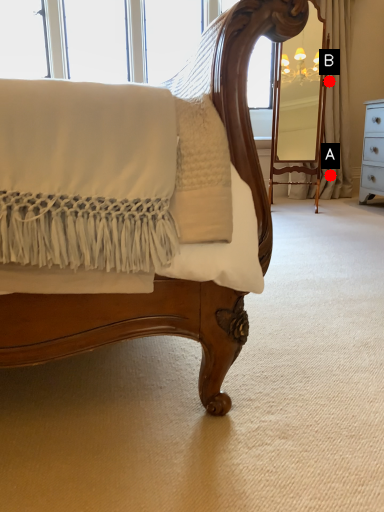
Question: Two points are circled on the image, labeled by A and B beside each circle. Which of the following is the farthest from the observer?

Choices:
 (A) A is further
 (B) B is further

Answer: (A)